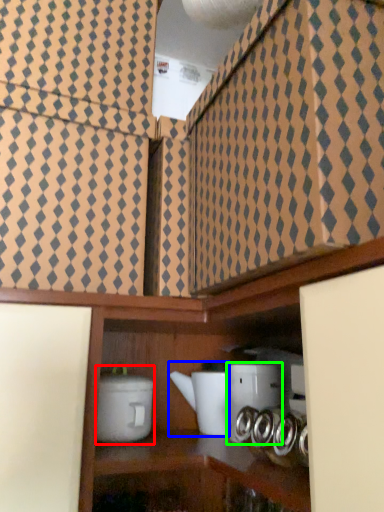
Question: Considering the real-world distances, which object is farthest from appliance (highlighted by a red box)? appliance (highlighted by a blue box) or appliance (highlighted by a green box)?

Choices:
 (A) appliance
 (B) appliance

Answer: (B)